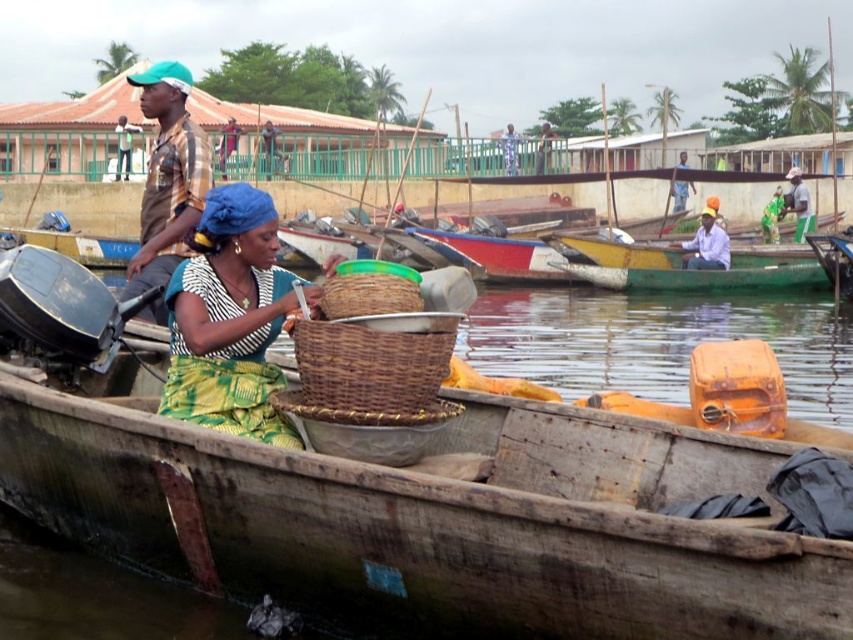
Is green woven basket at center smaller than brown woven basket at center?

No.

Who is more distant from viewer, (260, 349) or (380, 296)?

Point (260, 349)

Where is `green woven basket at center`? green woven basket at center is located at coordinates (230, 320).

Can you confirm if matte yellow shirt at left is thinner than green wooden boat at center?

No, matte yellow shirt at left is not thinner than green wooden boat at center.

In the scene shown: How far apart are matte yellow shirt at left and green wooden boat at center?

The distance of matte yellow shirt at left from green wooden boat at center is 73.21 feet.

Where is `matte yellow shirt at left`? The width and height of the screenshot is (853, 640). matte yellow shirt at left is located at coordinates (167, 177).

How far apart are brown woven basket at center and blue fabric headscarf at upper center?

A distance of 48.15 meters exists between brown woven basket at center and blue fabric headscarf at upper center.

Which is in front, point (349, 314) or point (515, 163)?

Point (349, 314) is in front.

This screenshot has width=853, height=640. I want to click on brown woven basket at center, so click(368, 294).